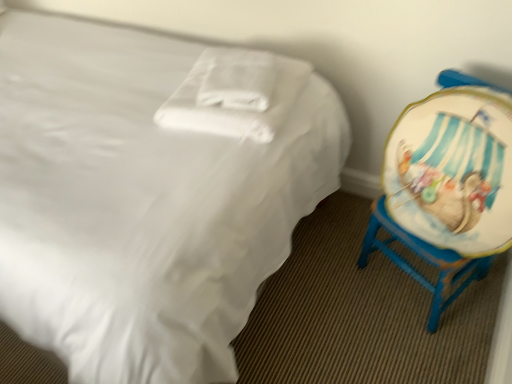
Question: From the image's perspective, would you say wooden painted chair at right is shown under white soft pillow at center?

Choices:
 (A) no
 (B) yes

Answer: (B)

Question: Would you say wooden painted chair at right contains white soft pillow at center?

Choices:
 (A) no
 (B) yes

Answer: (A)

Question: Does wooden painted chair at right have a lesser width compared to white soft pillow at center?

Choices:
 (A) yes
 (B) no

Answer: (A)

Question: From the image's perspective, does wooden painted chair at right appear higher than white soft pillow at center?

Choices:
 (A) no
 (B) yes

Answer: (A)

Question: Is wooden painted chair at right positioned beyond the bounds of white soft pillow at center?

Choices:
 (A) no
 (B) yes

Answer: (B)

Question: Is white soft pillow at center inside the boundaries of wooden painted chair at right, or outside?

Choices:
 (A) inside
 (B) outside

Answer: (B)

Question: Would you say white soft pillow at center is to the left or to the right of wooden painted chair at right in the picture?

Choices:
 (A) right
 (B) left

Answer: (B)

Question: Relative to wooden painted chair at right, is white soft pillow at center in front or behind?

Choices:
 (A) front
 (B) behind

Answer: (B)

Question: From a real-world perspective, relative to wooden painted chair at right, is white soft pillow at center vertically above or below?

Choices:
 (A) above
 (B) below

Answer: (A)

Question: Considering the positions of point (70, 221) and point (445, 279), is point (70, 221) closer or farther from the camera than point (445, 279)?

Choices:
 (A) farther
 (B) closer

Answer: (B)

Question: Is white satin bed at center bigger or smaller than wooden painted chair at right?

Choices:
 (A) small
 (B) big

Answer: (B)

Question: From a real-world perspective, is white satin bed at center above or below wooden painted chair at right?

Choices:
 (A) below
 (B) above

Answer: (B)

Question: Choose the correct answer: Is white satin bed at center inside wooden painted chair at right or outside it?

Choices:
 (A) outside
 (B) inside

Answer: (A)

Question: Based on their sizes in the image, would you say wooden painted chair at right is bigger or smaller than white soft pillow at center?

Choices:
 (A) big
 (B) small

Answer: (A)

Question: In terms of width, does wooden painted chair at right look wider or thinner when compared to white soft pillow at center?

Choices:
 (A) wide
 (B) thin

Answer: (B)